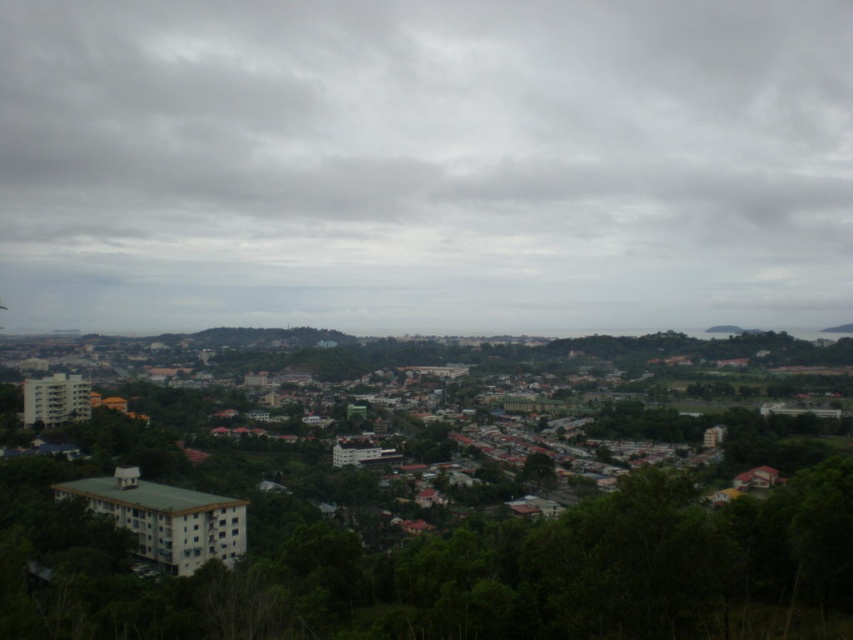
Question: Does gray cloudy sky at upper center have a smaller size compared to green leafy tree at center?

Choices:
 (A) yes
 (B) no

Answer: (A)

Question: Can you confirm if gray cloudy sky at upper center is smaller than green leafy tree at center?

Choices:
 (A) no
 (B) yes

Answer: (B)

Question: Is gray cloudy sky at upper center in front of green leafy tree at center?

Choices:
 (A) no
 (B) yes

Answer: (A)

Question: Which point is farther to the camera?

Choices:
 (A) (596, 77)
 (B) (640, 563)

Answer: (A)

Question: Among these objects, which one is farthest from the camera?

Choices:
 (A) green leafy tree at center
 (B) gray cloudy sky at upper center

Answer: (B)